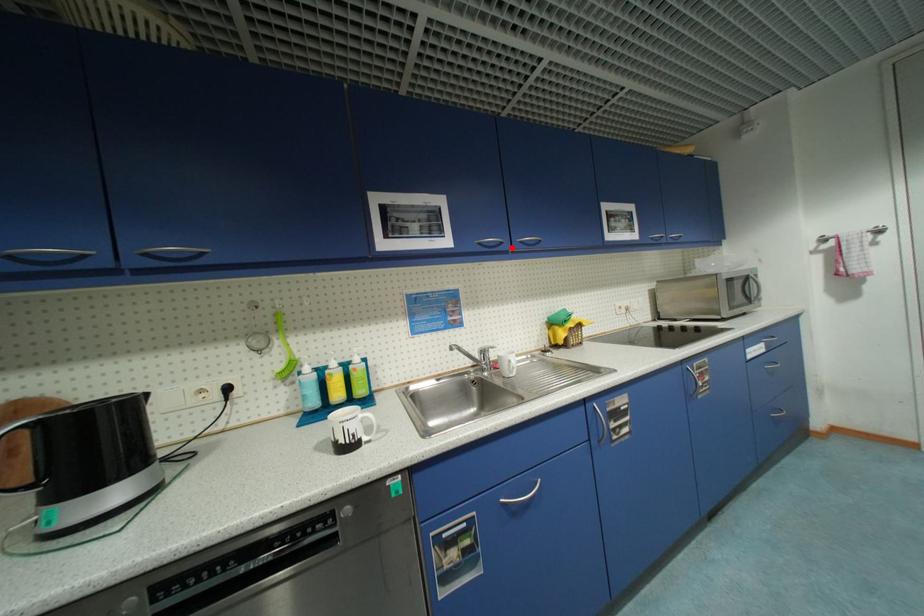
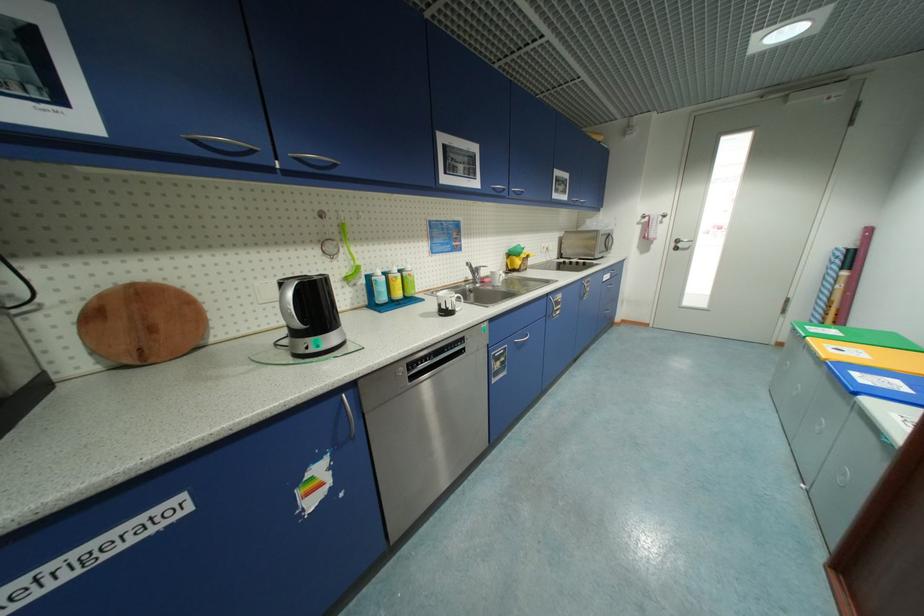
The point at the highlighted location is marked in the first image. Where is the corresponding point in the second image?

(512, 195)